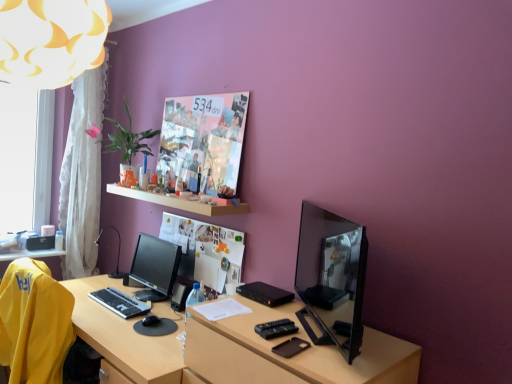
This screenshot has height=384, width=512. What do you see at coordinates (181, 202) in the screenshot? I see `white wooden shelf at upper center` at bounding box center [181, 202].

Describe the element at coordinates (25, 157) in the screenshot. Image resolution: width=512 pixels, height=384 pixels. I see `transparent glass window at left` at that location.

Looking at this image, what is the approximate width of white fabric lampshade at upper left?

white fabric lampshade at upper left is 20.28 inches wide.

This screenshot has height=384, width=512. What do you see at coordinates (119, 302) in the screenshot?
I see `black plastic keyboard at lower left` at bounding box center [119, 302].

In order to click on satin black monitor at center, marked as the second computer monitor in a front-to-back arrangement in this screenshot , I will do `click(155, 267)`.

Which object is wider, satin black monitor at center, the second computer monitor positioned from the right, or white wooden shelf at upper center?

Wider between the two is white wooden shelf at upper center.

Can we say satin black monitor at center, which is the 1th computer monitor from back to front, lies outside white wooden shelf at upper center?

That's correct, satin black monitor at center, which is the 1th computer monitor from back to front, is outside of white wooden shelf at upper center.

Is satin black monitor at center, which is the 1th computer monitor from back to front, not near white wooden shelf at upper center?

satin black monitor at center, which is the 1th computer monitor from back to front, is actually quite close to white wooden shelf at upper center.

Which object is closer to the camera taking this photo, satin black monitor at center, which is the 1th computer monitor from back to front, or white wooden shelf at upper center?

Positioned in front is white wooden shelf at upper center.

Considering the points (197, 331) and (141, 192), which point is behind, point (197, 331) or point (141, 192)?

Point (141, 192)

Which is more to the left, matte black tv at right or white wooden shelf at upper center?

white wooden shelf at upper center.

Is matte black tv at right directly adjacent to white wooden shelf at upper center?

matte black tv at right and white wooden shelf at upper center are not in contact.

Which object is more forward, matte black tv at right or white wooden shelf at upper center?

matte black tv at right is closer to the camera.

Are white fabric lampshade at upper left and satin black monitor at center, arranged as the first computer monitor when viewed from the left, beside each other?

No, white fabric lampshade at upper left is not in contact with satin black monitor at center, arranged as the first computer monitor when viewed from the left.

In the scene shown: Which of these two, white fabric lampshade at upper left or satin black monitor at center, arranged as the first computer monitor when viewed from the left, stands shorter?

satin black monitor at center, arranged as the first computer monitor when viewed from the left.

Does point (97, 37) appear closer or farther from the camera than point (168, 260)?

Point (97, 37) appears to be closer to the viewer than point (168, 260).

Which is in front, point (89, 68) or point (407, 369)?

Positioned in front is point (89, 68).

From the image's perspective, which is above, white fabric lampshade at upper left or matte black tv at right?

white fabric lampshade at upper left is shown above in the image.

Which is behind, white fabric lampshade at upper left or matte black tv at right?

matte black tv at right is further from the camera.

Find the location of `desk below the white fabric lampshade at upper left (from a real-world perspective)`. desk below the white fabric lampshade at upper left (from a real-world perspective) is located at coordinates (232, 347).

Can you confirm if black plastic keyboard at lower left is thinner than white sheer curtain at left?

Indeed, black plastic keyboard at lower left has a lesser width compared to white sheer curtain at left.

The image size is (512, 384). I want to click on curtain that appears above the black plastic keyboard at lower left (from a real-world perspective), so click(82, 175).

Could you tell me if black plastic keyboard at lower left is facing white sheer curtain at left?

No, black plastic keyboard at lower left is not turned towards white sheer curtain at left.

How different are the orientations of black plastic keyboard at lower left and white wooden shelf at upper center in degrees?

1.26 degrees.

From the image's perspective, is black plastic keyboard at lower left above white wooden shelf at upper center?

Actually, black plastic keyboard at lower left appears below white wooden shelf at upper center in the image.

Between black plastic keyboard at lower left and white wooden shelf at upper center, which one has larger width?

Wider between the two is white wooden shelf at upper center.

How distant is black plastic keyboard at lower left from white wooden shelf at upper center?

A distance of 24.37 inches exists between black plastic keyboard at lower left and white wooden shelf at upper center.

From a real-world perspective, is wooden desk at center physically below shiny black monitor at right, the 2th computer monitor positioned from the left?

Yes, from a real-world perspective, wooden desk at center is below shiny black monitor at right, the 2th computer monitor positioned from the left.

Could you tell me if wooden desk at center is turned towards shiny black monitor at right, the 1th computer monitor from the front?

No, wooden desk at center is not aimed at shiny black monitor at right, the 1th computer monitor from the front.

Looking at the image, does wooden desk at center seem bigger or smaller compared to shiny black monitor at right, acting as the second computer monitor starting from the back?

Clearly, wooden desk at center is larger in size than shiny black monitor at right, acting as the second computer monitor starting from the back.

The height and width of the screenshot is (384, 512). I want to click on shelf above the satin black monitor at center, the second computer monitor positioned from the right (from a real-world perspective), so click(x=181, y=202).

The height and width of the screenshot is (384, 512). What are the coordinates of `desk below the white wooden shelf at upper center (from the image's perspective)` in the screenshot? It's located at (232, 347).

From the image, which object appears to be nearer to satin black monitor at center, which is the 1th computer monitor from back to front, black plastic table lamp at left or transparent glass window at left?

Based on the image, black plastic table lamp at left appears to be nearer to satin black monitor at center, which is the 1th computer monitor from back to front.

From the image, which object appears to be nearer to matte black tv at right, shiny black monitor at right, arranged as the first computer monitor when viewed from the right, or white wooden shelf at upper center?

shiny black monitor at right, arranged as the first computer monitor when viewed from the right.

Which object lies nearer to the anchor point wooden desk at center, transparent glass window at left or white wooden shelf at upper center?

The object closer to wooden desk at center is white wooden shelf at upper center.

Based on their spatial positions, is black plastic keyboard at lower left or white wooden shelf at upper center further from yellow fabric chair at lower left?

The object further to yellow fabric chair at lower left is white wooden shelf at upper center.

Estimate the real-world distances between objects in this image. Which object is further from matte black tv at right, satin black monitor at center, which is the 1th computer monitor from back to front, or white sheer curtain at left?

Based on the image, white sheer curtain at left appears to be further to matte black tv at right.

Consider the image. Considering their positions, is shiny black monitor at right, arranged as the first computer monitor when viewed from the right, positioned further to yellow fabric chair at lower left than matte black tv at right?

shiny black monitor at right, arranged as the first computer monitor when viewed from the right.

From the image, which object appears to be farther from white fabric lampshade at upper left, transparent glass window at left or shiny black monitor at right, acting as the second computer monitor starting from the back?

Among the two, transparent glass window at left is located further to white fabric lampshade at upper left.

Looking at the image, which one is located further to matte black tv at right, shiny black monitor at right, the 1th computer monitor from the front, or black plastic keyboard at lower left?

Among the two, black plastic keyboard at lower left is located further to matte black tv at right.

This screenshot has height=384, width=512. I want to click on shelf between transparent glass window at left and wooden desk at center in the up-down direction, so click(181, 202).

This screenshot has height=384, width=512. I want to click on computer monitor between matte black tv at right and satin black monitor at center, marked as the second computer monitor in a front-to-back arrangement, along the z-axis, so click(x=332, y=276).

Locate an element on the screen. The width and height of the screenshot is (512, 384). computer keyboard between white fabric lampshade at upper left and transparent glass window at left from front to back is located at coordinates pos(119,302).

The height and width of the screenshot is (384, 512). What are the coordinates of `vanity between shiny black monitor at right, arranged as the first computer monitor when viewed from the right, and black plastic table lamp at left in the front-back direction` in the screenshot? It's located at [x=123, y=336].